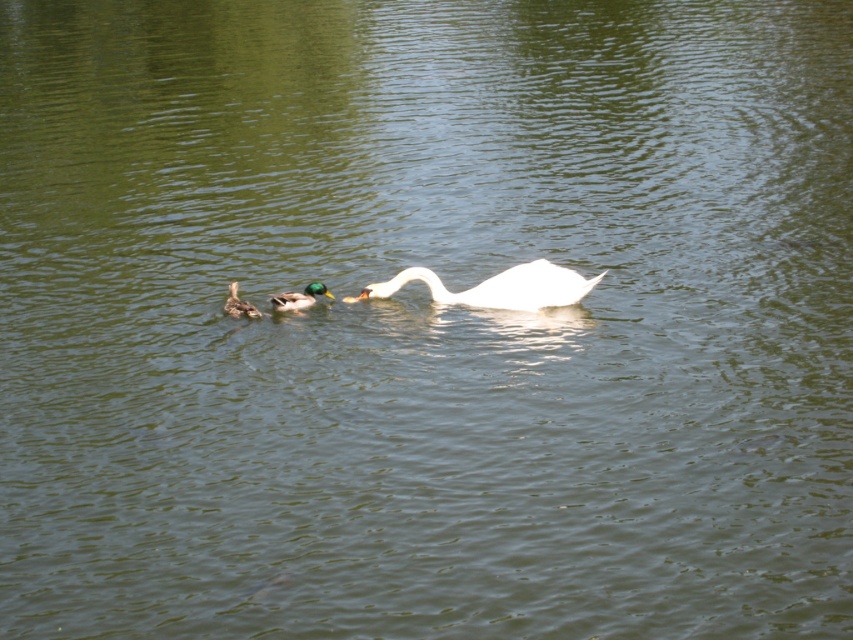
Does point (442, 300) come behind point (276, 300)?

That is True.

At what (x,y) coordinates should I click in order to perform the action: click on white glossy swan at center. Please return your answer as a coordinate pair (x, y). Looking at the image, I should click on (497, 288).

Does point (560, 282) come farther from viewer compared to point (271, 300)?

No, (560, 282) is in front of (271, 300).

You are a GUI agent. You are given a task and a screenshot of the screen. Output one action in this format:
    pyautogui.click(x=<x>, y=<y>)
    Task: Click on the white glossy swan at center
    The image size is (853, 640).
    Given the screenshot: What is the action you would take?
    pyautogui.click(x=497, y=288)

Is green glossy duck at center wider than brown matte duckling at lower left?

Indeed, green glossy duck at center has a greater width compared to brown matte duckling at lower left.

Is green glossy duck at center to the right of brown matte duckling at lower left from the viewer's perspective?

Correct, you'll find green glossy duck at center to the right of brown matte duckling at lower left.

Describe the element at coordinates (299, 298) in the screenshot. I see `green glossy duck at center` at that location.

I want to click on green glossy duck at center, so click(x=299, y=298).

Describe the element at coordinates (497, 288) in the screenshot. The height and width of the screenshot is (640, 853). I see `white glossy swan at center` at that location.

Does white glossy swan at center appear on the right side of brown matte duckling at lower left?

Correct, you'll find white glossy swan at center to the right of brown matte duckling at lower left.

You are a GUI agent. You are given a task and a screenshot of the screen. Output one action in this format:
    pyautogui.click(x=<x>, y=<y>)
    Task: Click on the white glossy swan at center
    The image size is (853, 640).
    Given the screenshot: What is the action you would take?
    pyautogui.click(x=497, y=288)

This screenshot has width=853, height=640. What are the coordinates of `white glossy swan at center` in the screenshot? It's located at (497, 288).